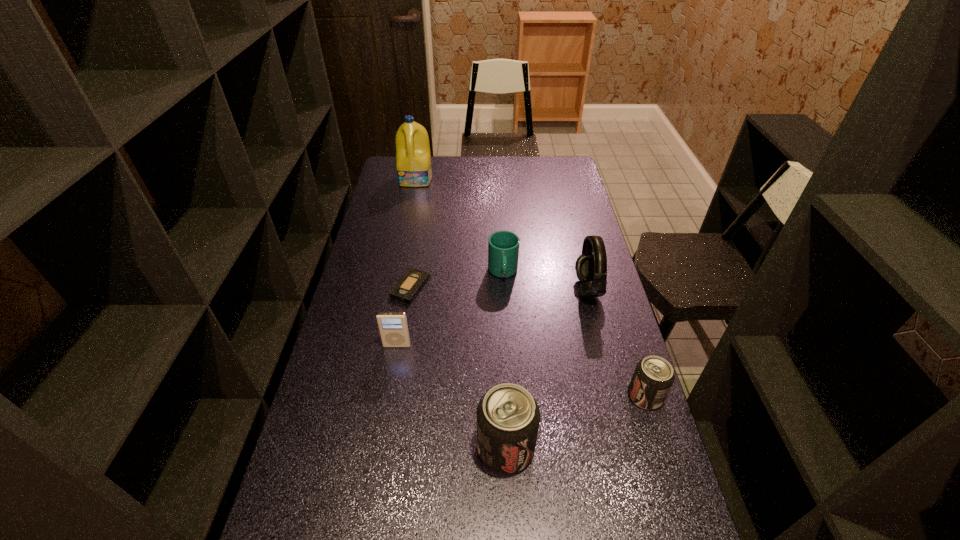
With all soda cans evenly spaced, where should an extra soda can be placed on the left to continue the pattern? Please point out a vacant space. Please provide its 2D coordinates. Your answer should be formatted as a tuple, i.e. [(x, y)], where the tuple contains the x and y coordinates of a point satisfying the conditions above.

[(336, 510)]